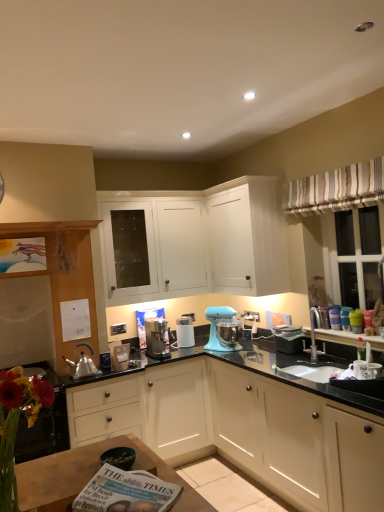
The height and width of the screenshot is (512, 384). Describe the element at coordinates (336, 189) in the screenshot. I see `striped fabric curtain at upper right` at that location.

You are a GUI agent. You are given a task and a screenshot of the screen. Output one action in this format:
    pyautogui.click(x=<x>, y=<y>)
    Task: Click on the white plastic coffee maker at center
    
    Given the screenshot: What is the action you would take?
    pyautogui.click(x=185, y=332)

This screenshot has height=512, width=384. What are the coordinates of `matte white cabinet at left, arranged as the second cabinetry when ordered from the bottom` in the screenshot? It's located at (64, 270).

The width and height of the screenshot is (384, 512). What are the coordinates of `white matte cabinet at center, the 3th cabinetry ordered from the bottom` in the screenshot? It's located at (154, 249).

Find the location of `striped fabric curtain at upper right`. striped fabric curtain at upper right is located at coordinates (336, 189).

Consider the image. In terms of height, does light blue plastic stand mixer at center look taller or shorter compared to matte white cabinet at left, arranged as the second cabinetry when ordered from the bottom?

In the image, light blue plastic stand mixer at center appears to be shorter than matte white cabinet at left, arranged as the second cabinetry when ordered from the bottom.

Is light blue plastic stand mixer at center situated inside matte white cabinet at left, arranged as the second cabinetry when ordered from the bottom, or outside?

light blue plastic stand mixer at center cannot be found inside matte white cabinet at left, arranged as the second cabinetry when ordered from the bottom.

From the image's perspective, is light blue plastic stand mixer at center on matte white cabinet at left, arranged as the second cabinetry when ordered from the bottom?

No.

From a real-world perspective, who is located higher, light blue plastic stand mixer at center or matte white cabinet at left, arranged as the second cabinetry when ordered from the bottom?

matte white cabinet at left, arranged as the second cabinetry when ordered from the bottom, is physically above.

Is vibrant bouquet at lower left further to the viewer compared to white matte cabinet at center, which is the fourth cabinetry in top-to-bottom order?

No.

Is vibrant bouquet at lower left not close to white matte cabinet at center, positioned as the first cabinetry in bottom-to-top order?

Absolutely, vibrant bouquet at lower left is distant from white matte cabinet at center, positioned as the first cabinetry in bottom-to-top order.

Is vibrant bouquet at lower left taller or shorter than white matte cabinet at center, which is the fourth cabinetry in top-to-bottom order?

vibrant bouquet at lower left is shorter than white matte cabinet at center, which is the fourth cabinetry in top-to-bottom order.

Is vibrant bouquet at lower left to the left or to the right of light blue plastic stand mixer at center in the image?

vibrant bouquet at lower left is to the left of light blue plastic stand mixer at center.

Considering the relative sizes of vibrant bouquet at lower left and light blue plastic stand mixer at center in the image provided, is vibrant bouquet at lower left wider than light blue plastic stand mixer at center?

Incorrect, the width of vibrant bouquet at lower left does not surpass that of light blue plastic stand mixer at center.

From a real-world perspective, is vibrant bouquet at lower left over light blue plastic stand mixer at center?

Yes.

Is vibrant bouquet at lower left oriented towards light blue plastic stand mixer at center?

No, vibrant bouquet at lower left is not aimed at light blue plastic stand mixer at center.

Is printed paper magazine at lower center smaller than vibrant bouquet at lower left?

Correct, printed paper magazine at lower center occupies less space than vibrant bouquet at lower left.

Is printed paper magazine at lower center aimed at vibrant bouquet at lower left?

No, printed paper magazine at lower center is not oriented towards vibrant bouquet at lower left.

Is printed paper magazine at lower center completely or partially outside of vibrant bouquet at lower left?

Yes, printed paper magazine at lower center is not within vibrant bouquet at lower left.

Does printed paper magazine at lower center have a greater height compared to vibrant bouquet at lower left?

No.

Can you confirm if shiny silver tea pot at left is shorter than matte white cabinet at left, arranged as the second cabinetry when ordered from the bottom?

Correct, shiny silver tea pot at left is not as tall as matte white cabinet at left, arranged as the second cabinetry when ordered from the bottom.

Does shiny silver tea pot at left appear on the left side of matte white cabinet at left, the 3th cabinetry in the top-to-bottom sequence?

In fact, shiny silver tea pot at left is to the right of matte white cabinet at left, the 3th cabinetry in the top-to-bottom sequence.

Considering the relative sizes of shiny silver tea pot at left and matte white cabinet at left, the 3th cabinetry in the top-to-bottom sequence, in the image provided, is shiny silver tea pot at left thinner than matte white cabinet at left, the 3th cabinetry in the top-to-bottom sequence,?

Incorrect, the width of shiny silver tea pot at left is not less than that of matte white cabinet at left, the 3th cabinetry in the top-to-bottom sequence.

From a real-world perspective, which is physically above, shiny silver tea pot at left or matte white cabinet at left, arranged as the second cabinetry when ordered from the bottom?

matte white cabinet at left, arranged as the second cabinetry when ordered from the bottom, is physically above.

Considering the sizes of wooden table at lower left and printed paper magazine at lower center in the image, is wooden table at lower left wider or thinner than printed paper magazine at lower center?

wooden table at lower left is wider than printed paper magazine at lower center.

Is wooden table at lower left not inside printed paper magazine at lower center?

wooden table at lower left is positioned outside printed paper magazine at lower center.

Locate an element on the screen. This screenshot has height=512, width=384. table below the printed paper magazine at lower center (from the image's perspective) is located at coordinates (91, 476).

Is wooden table at lower left bigger or smaller than printed paper magazine at lower center?

wooden table at lower left is bigger than printed paper magazine at lower center.

Is striped fabric curtain at upper right aimed at white matte cabinet at upper center, marked as the 4th cabinetry in a bottom-to-top arrangement?

No, striped fabric curtain at upper right is not turned towards white matte cabinet at upper center, marked as the 4th cabinetry in a bottom-to-top arrangement.

Would you say striped fabric curtain at upper right is inside or outside white matte cabinet at upper center, marked as the 4th cabinetry in a bottom-to-top arrangement?

striped fabric curtain at upper right is located beyond the bounds of white matte cabinet at upper center, marked as the 4th cabinetry in a bottom-to-top arrangement.

Looking at their sizes, would you say striped fabric curtain at upper right is wider or thinner than white matte cabinet at upper center, arranged as the 1th cabinetry when viewed from the top?

striped fabric curtain at upper right is thinner than white matte cabinet at upper center, arranged as the 1th cabinetry when viewed from the top.

The image size is (384, 512). I want to click on kitchen appliance located behind the matte white cabinet at left, arranged as the second cabinetry when ordered from the bottom, so click(216, 327).

Identify the location of cabinetry that is the 2nd one when counting rightward from the vibrant bouquet at lower left. The height and width of the screenshot is (512, 384). (242, 429).

Estimate the real-world distances between objects in this image. Which object is closer to striped fabric curtain at upper right, white plastic coffee maker at center or white matte cabinet at upper center, arranged as the 1th cabinetry when viewed from the top?

white matte cabinet at upper center, arranged as the 1th cabinetry when viewed from the top, is closer to striped fabric curtain at upper right.

Considering their positions, is shiny silver tea pot at left positioned further to printed paper magazine at lower center than wooden table at lower left?

shiny silver tea pot at left is positioned further to the anchor printed paper magazine at lower center.

Considering their positions, is white matte cabinet at center, placed as the second cabinetry when sorted from top to bottom, positioned further to vibrant bouquet at lower left than shiny silver tea pot at left?

white matte cabinet at center, placed as the second cabinetry when sorted from top to bottom.

From the image, which object appears to be nearer to printed paper magazine at lower center, white plastic coffee maker at center or white matte cabinet at upper center, arranged as the 1th cabinetry when viewed from the top?

white matte cabinet at upper center, arranged as the 1th cabinetry when viewed from the top, is closer to printed paper magazine at lower center.

When comparing their distances from wooden table at lower left, does striped fabric curtain at upper right or shiny silver tea pot at left seem closer?

Among the two, shiny silver tea pot at left is located nearer to wooden table at lower left.

Based on their spatial positions, is printed paper magazine at lower center or shiny silver tea pot at left closer to white matte cabinet at center, placed as the second cabinetry when sorted from top to bottom?

shiny silver tea pot at left is closer to white matte cabinet at center, placed as the second cabinetry when sorted from top to bottom.

Which object lies further to the anchor point light blue plastic stand mixer at center, shiny silver tea pot at left or matte white cabinet at left, the 3th cabinetry in the top-to-bottom sequence?

The object further to light blue plastic stand mixer at center is matte white cabinet at left, the 3th cabinetry in the top-to-bottom sequence.

When comparing their distances from shiny silver tea pot at left, does printed paper magazine at lower center or wooden table at lower left seem further?

The object further to shiny silver tea pot at left is printed paper magazine at lower center.

At what (x,y) coordinates should I click in order to perform the action: click on cabinetry positioned between wooden table at lower left and white matte cabinet at center, positioned as the first cabinetry in bottom-to-top order, from near to far. Please return your answer as a coordinate pair (x, y). Looking at the image, I should click on (64, 270).

Locate an element on the screen. The image size is (384, 512). tea pot between matte white cabinet at left, arranged as the second cabinetry when ordered from the bottom, and white matte cabinet at upper center, arranged as the 1th cabinetry when viewed from the top is located at coordinates (82, 366).

What are the coordinates of `table between printed paper magazine at lower center and light blue plastic stand mixer at center in the front-back direction` in the screenshot? It's located at (91, 476).

The height and width of the screenshot is (512, 384). I want to click on cabinetry positioned between printed paper magazine at lower center and white matte cabinet at center, which is the fourth cabinetry in top-to-bottom order, from near to far, so click(x=64, y=270).